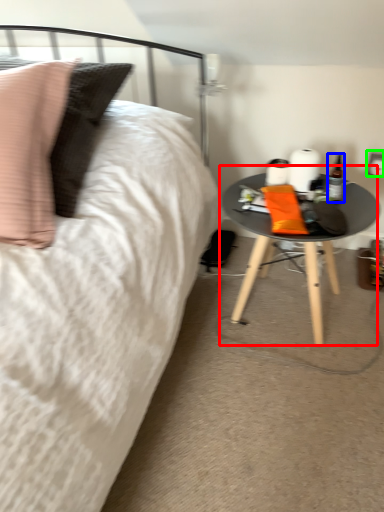
Question: Which object is positioned farthest from table (highlighted by a red box)? Select from bottle (highlighted by a blue box) and electric outlet (highlighted by a green box).

Choices:
 (A) bottle
 (B) electric outlet

Answer: (B)